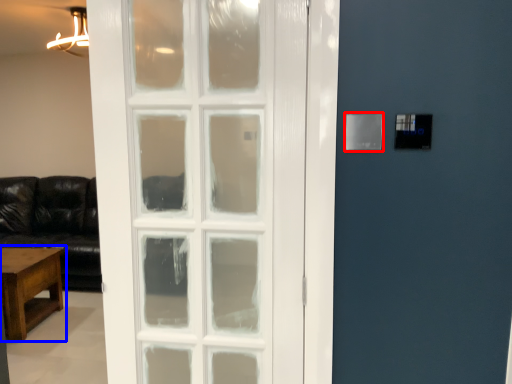
Question: Which point is further to the camera, light switch (highlighted by a red box) or table (highlighted by a blue box)?

Choices:
 (A) light switch
 (B) table

Answer: (B)